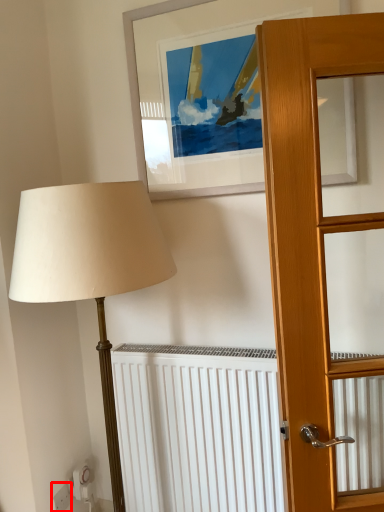
Question: Where is electric outlet (annotated by the red box) located in relation to picture frame in the image?

Choices:
 (A) left
 (B) right

Answer: (A)